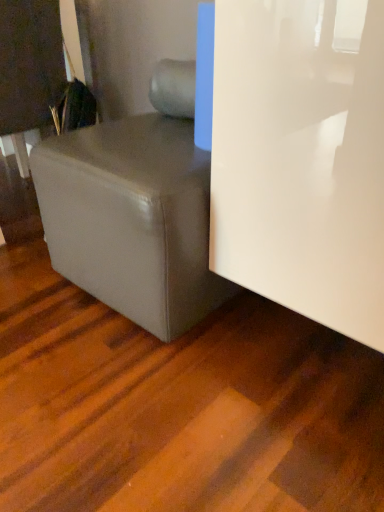
Question: From a real-world perspective, is white glossy door at right physically located above or below matte black book at upper left?

Choices:
 (A) below
 (B) above

Answer: (A)

Question: Considering the positions of white glossy door at right and matte black book at upper left in the image, is white glossy door at right wider or thinner than matte black book at upper left?

Choices:
 (A) wide
 (B) thin

Answer: (A)

Question: Considering the real-world distances, which object is closest to the white glossy door at right?

Choices:
 (A) matte black book at upper left
 (B) matte gray ottoman at lower left

Answer: (B)

Question: Which object is the closest to the matte black book at upper left?

Choices:
 (A) white glossy door at right
 (B) matte gray ottoman at lower left

Answer: (B)